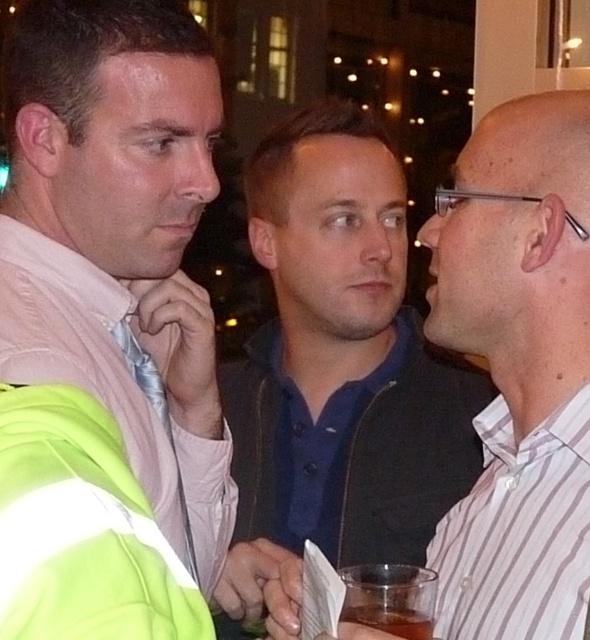
You are standing in the room and see the point at coordinates (509,540). If you want to reach it with your outstretched hand, which is 36 inches long, can you reach it without moving closer?

The point at coordinates (509,540) is 38.48 inches away from the viewer. Since your outstretched hand is only 36 inches long, you cannot reach it without moving closer.